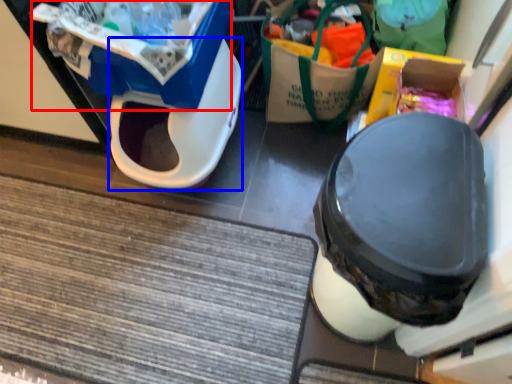
Question: Which of the following is the closest to the observer, storage box (highlighted by a red box) or wide (highlighted by a blue box)?

Choices:
 (A) storage box
 (B) wide

Answer: (A)